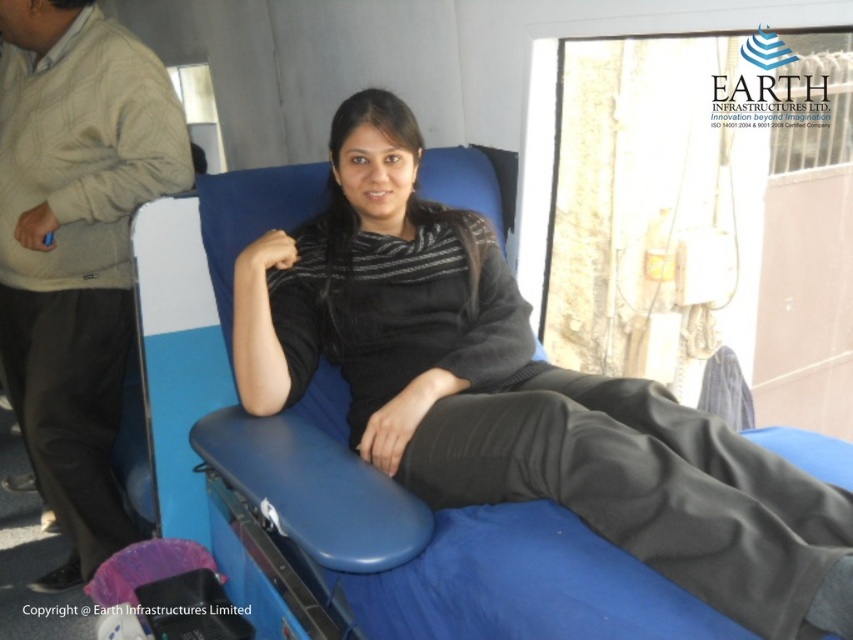
You are a photographer setting up for a group photo in the blood donation unit. You need to position the matte black sweater at center and the matte beige coach at left so that they are both visible in the frame. Given their sizes, which object should you place closer to the camera to ensure both fit well in the photo?

The matte black sweater at center is bigger than the matte beige coach at left, so to ensure both fit well in the photo, you should place the matte black sweater at center closer to the camera. This way, its larger size will be balanced with the smaller matte beige coach at left positioned further back.

You are a nurse in the blood donation unit. You need to locate both the matte black sweater at center and the matte beige coach at left. Which one is positioned lower in the image?

The matte black sweater at center is located below the matte beige coach at left, so it is positioned lower in the image.